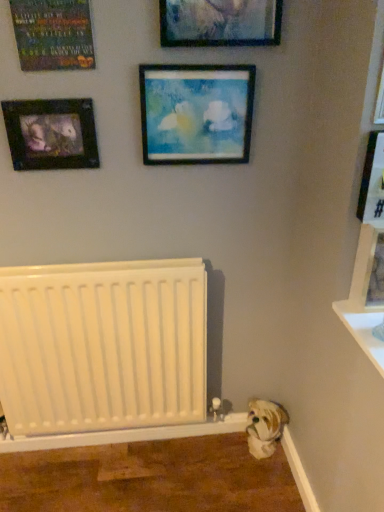
Where is `wooden frame at center, marked as the fifth picture frame in a right-to-left arrangement`? This screenshot has height=512, width=384. wooden frame at center, marked as the fifth picture frame in a right-to-left arrangement is located at coordinates (196, 113).

At what (x,y) coordinates should I click in order to perform the action: click on wooden picture frame at right, acting as the 6th picture frame starting from the left. Please return your answer as a coordinate pair (x, y). Looking at the image, I should click on (372, 182).

Identify the location of matte black picture frame at upper left, which ranks as the 7th picture frame in right-to-left order. (51, 134).

Describe the element at coordinates (51, 134) in the screenshot. I see `matte black picture frame at upper left, which ranks as the 7th picture frame in right-to-left order` at that location.

The width and height of the screenshot is (384, 512). Identify the location of metallic silver picture frame at upper right, placed as the 3th picture frame when sorted from right to left. (379, 99).

The width and height of the screenshot is (384, 512). In order to click on matte black poster at upper left, which appears as the 2th picture frame when viewed from the left in this screenshot , I will do `click(53, 34)`.

Where is `wooden frame at center, marked as the fifth picture frame in a right-to-left arrangement`? The height and width of the screenshot is (512, 384). wooden frame at center, marked as the fifth picture frame in a right-to-left arrangement is located at coordinates (196, 113).

From a real-world perspective, which object stands above the other?

matte black picture frame at upper left, the first picture frame from the left.

Which of these two, matte black picture frame at upper left, which ranks as the 7th picture frame in right-to-left order, or wooden picture frame at right, marked as the 2th picture frame in a right-to-left arrangement, stands shorter?

matte black picture frame at upper left, which ranks as the 7th picture frame in right-to-left order.

Could you tell me if matte black picture frame at upper left, the first picture frame from the left, is facing wooden picture frame at right, marked as the 2th picture frame in a right-to-left arrangement?

No, matte black picture frame at upper left, the first picture frame from the left, is not turned towards wooden picture frame at right, marked as the 2th picture frame in a right-to-left arrangement.

Are matte black picture frame at upper left, the first picture frame from the left, and wooden picture frame at right, acting as the 6th picture frame starting from the left, far apart?

No, matte black picture frame at upper left, the first picture frame from the left, is in close proximity to wooden picture frame at right, acting as the 6th picture frame starting from the left.

Is point (266, 410) positioned behind point (173, 404)?

Yes, point (266, 410) is behind point (173, 404).

Which object is thinner, white plush dog at lower right or white matte radiator at lower left?

white matte radiator at lower left is thinner.

What's the angular difference between white plush dog at lower right and white matte radiator at lower left's facing directions?

white plush dog at lower right and white matte radiator at lower left are facing 43 degrees away from each other.

Is white plush dog at lower right facing towards white matte radiator at lower left?

No, white plush dog at lower right is not oriented towards white matte radiator at lower left.

Can you tell me how much white glossy shelf at lower right and metallic silver picture frame at upper right, placed as the 3th picture frame when sorted from right to left, differ in facing direction?

The angle between the facing direction of white glossy shelf at lower right and the facing direction of metallic silver picture frame at upper right, placed as the 3th picture frame when sorted from right to left, is 1.08 degrees.

Can metallic silver picture frame at upper right, placed as the 3th picture frame when sorted from right to left, be found inside white glossy shelf at lower right?

No, metallic silver picture frame at upper right, placed as the 3th picture frame when sorted from right to left, is not surrounded by white glossy shelf at lower right.

Is white glossy shelf at lower right looking in the opposite direction of metallic silver picture frame at upper right, placed as the 3th picture frame when sorted from right to left?

No, metallic silver picture frame at upper right, placed as the 3th picture frame when sorted from right to left, is not at the back of white glossy shelf at lower right.

Does white glossy shelf at lower right have a smaller size compared to metallic silver picture frame at upper right, which appears as the 5th picture frame when viewed from the left?

No, white glossy shelf at lower right is not smaller than metallic silver picture frame at upper right, which appears as the 5th picture frame when viewed from the left.

From the image's perspective, is matte black poster at upper left, the 6th picture frame when ordered from right to left, above white plush dog at lower right?

Yes.

Is matte black poster at upper left, the 6th picture frame when ordered from right to left, touching white plush dog at lower right?

No, matte black poster at upper left, the 6th picture frame when ordered from right to left, is not in contact with white plush dog at lower right.

Looking at this image, is matte black poster at upper left, which appears as the 2th picture frame when viewed from the left, facing away from white plush dog at lower right?

No, matte black poster at upper left, which appears as the 2th picture frame when viewed from the left, is not facing the opposite direction of white plush dog at lower right.

Which is behind, point (80, 9) or point (275, 412)?

Positioned behind is point (275, 412).

From the image's perspective, between matte black poster at upper left, the 6th picture frame when ordered from right to left, and metallic silver picture frame at upper right, which appears as the 5th picture frame when viewed from the left, who is located below?

metallic silver picture frame at upper right, which appears as the 5th picture frame when viewed from the left, from the image's perspective.

Does matte black poster at upper left, the 6th picture frame when ordered from right to left, have a lesser width compared to metallic silver picture frame at upper right, placed as the 3th picture frame when sorted from right to left?

Yes.

Can you see matte black poster at upper left, the 6th picture frame when ordered from right to left, touching metallic silver picture frame at upper right, which appears as the 5th picture frame when viewed from the left?

No.

From a real-world perspective, relative to metallic silver picture frame at upper right, which appears as the 5th picture frame when viewed from the left, is matte black poster at upper left, the 6th picture frame when ordered from right to left, vertically above or below?

Clearly, from a real-world perspective, matte black poster at upper left, the 6th picture frame when ordered from right to left, is above metallic silver picture frame at upper right, which appears as the 5th picture frame when viewed from the left.

Between metallic silver picture frame at upper right, which appears as the 5th picture frame when viewed from the left, and matte black poster at upper left, which appears as the 2th picture frame when viewed from the left, which one is positioned behind?

matte black poster at upper left, which appears as the 2th picture frame when viewed from the left, is further from the camera.

What's the angular difference between metallic silver picture frame at upper right, placed as the 3th picture frame when sorted from right to left, and matte black poster at upper left, which appears as the 2th picture frame when viewed from the left,'s facing directions?

0.829 degrees separate the facing orientations of metallic silver picture frame at upper right, placed as the 3th picture frame when sorted from right to left, and matte black poster at upper left, which appears as the 2th picture frame when viewed from the left.

Is metallic silver picture frame at upper right, placed as the 3th picture frame when sorted from right to left, facing towards matte black poster at upper left, the 6th picture frame when ordered from right to left?

No, metallic silver picture frame at upper right, placed as the 3th picture frame when sorted from right to left, does not turn towards matte black poster at upper left, the 6th picture frame when ordered from right to left.

Is metallic silver picture frame at upper right, placed as the 3th picture frame when sorted from right to left, not close to matte black poster at upper left, the 6th picture frame when ordered from right to left?

They are positioned close to each other.

How many degrees apart are the facing directions of white plush dog at lower right and wooden picture frame at right, acting as the 1th picture frame starting from the right?

The angle between the facing direction of white plush dog at lower right and the facing direction of wooden picture frame at right, acting as the 1th picture frame starting from the right, is 42.6 degrees.

In the image, is white plush dog at lower right on the left side or the right side of wooden picture frame at right, the seventh picture frame in the left-to-right sequence?

In the image, white plush dog at lower right appears on the left side of wooden picture frame at right, the seventh picture frame in the left-to-right sequence.

From a real-world perspective, is white plush dog at lower right on wooden picture frame at right, acting as the 1th picture frame starting from the right?

Incorrect, from a real-world perspective, white plush dog at lower right is lower than wooden picture frame at right, acting as the 1th picture frame starting from the right.

From the image's perspective, is white plush dog at lower right below wooden picture frame at right, acting as the 1th picture frame starting from the right?

Yes, from the image's perspective, white plush dog at lower right is beneath wooden picture frame at right, acting as the 1th picture frame starting from the right.

From the image's perspective, starting from the matte black picture frame at upper left, which ranks as the 7th picture frame in right-to-left order, which picture frame is the 1st one below? Please provide its 2D coordinates.

[(372, 182)]

Where is `animal below the white matte radiator at lower left (from a real-world perspective)`? This screenshot has width=384, height=512. animal below the white matte radiator at lower left (from a real-world perspective) is located at coordinates (265, 426).

From the image, which object appears to be farther from matte glass picture frame at upper center, the 4th picture frame from the left, metallic silver picture frame at upper right, placed as the 3th picture frame when sorted from right to left, or matte black picture frame at upper left, the first picture frame from the left?

metallic silver picture frame at upper right, placed as the 3th picture frame when sorted from right to left.

Looking at the image, which one is located closer to wooden picture frame at right, acting as the 1th picture frame starting from the right, white plush dog at lower right or white glossy shelf at lower right?

white glossy shelf at lower right.

Based on their spatial positions, is matte black poster at upper left, which appears as the 2th picture frame when viewed from the left, or white plush dog at lower right closer to wooden frame at center, the third picture frame positioned from the left?

matte black poster at upper left, which appears as the 2th picture frame when viewed from the left, is positioned closer to the anchor wooden frame at center, the third picture frame positioned from the left.

When comparing their distances from wooden picture frame at right, marked as the 2th picture frame in a right-to-left arrangement, does matte glass picture frame at upper center, the 4th picture frame positioned from the right, or white plush dog at lower right seem further?

Among the two, white plush dog at lower right is located further to wooden picture frame at right, marked as the 2th picture frame in a right-to-left arrangement.

From the image, which object appears to be nearer to white plush dog at lower right, white matte radiator at lower left or wooden frame at center, the third picture frame positioned from the left?

Based on the image, white matte radiator at lower left appears to be nearer to white plush dog at lower right.

Which object lies nearer to the anchor point white glossy shelf at lower right, wooden frame at center, the third picture frame positioned from the left, or wooden picture frame at right, acting as the 6th picture frame starting from the left?

Based on the image, wooden picture frame at right, acting as the 6th picture frame starting from the left, appears to be nearer to white glossy shelf at lower right.

When comparing their distances from wooden picture frame at right, the seventh picture frame in the left-to-right sequence, does matte glass picture frame at upper center, the 4th picture frame from the left, or white glossy shelf at lower right seem closer?

white glossy shelf at lower right is positioned closer to the anchor wooden picture frame at right, the seventh picture frame in the left-to-right sequence.

Which object lies further to the anchor point matte black poster at upper left, which appears as the 2th picture frame when viewed from the left, wooden picture frame at right, acting as the 6th picture frame starting from the left, or white glossy shelf at lower right?

Among the two, white glossy shelf at lower right is located further to matte black poster at upper left, which appears as the 2th picture frame when viewed from the left.

I want to click on animal between white matte radiator at lower left and wooden picture frame at right, the seventh picture frame in the left-to-right sequence, so click(x=265, y=426).

Find the location of a particular element. window sill between matte black picture frame at upper left, the first picture frame from the left, and white plush dog at lower right from top to bottom is located at coordinates (363, 328).

Locate an element on the screen. animal situated between white matte radiator at lower left and white glossy shelf at lower right from left to right is located at coordinates (265, 426).

This screenshot has width=384, height=512. I want to click on radiator situated between matte black picture frame at upper left, the first picture frame from the left, and metallic silver picture frame at upper right, which appears as the 5th picture frame when viewed from the left, from left to right, so click(x=103, y=346).